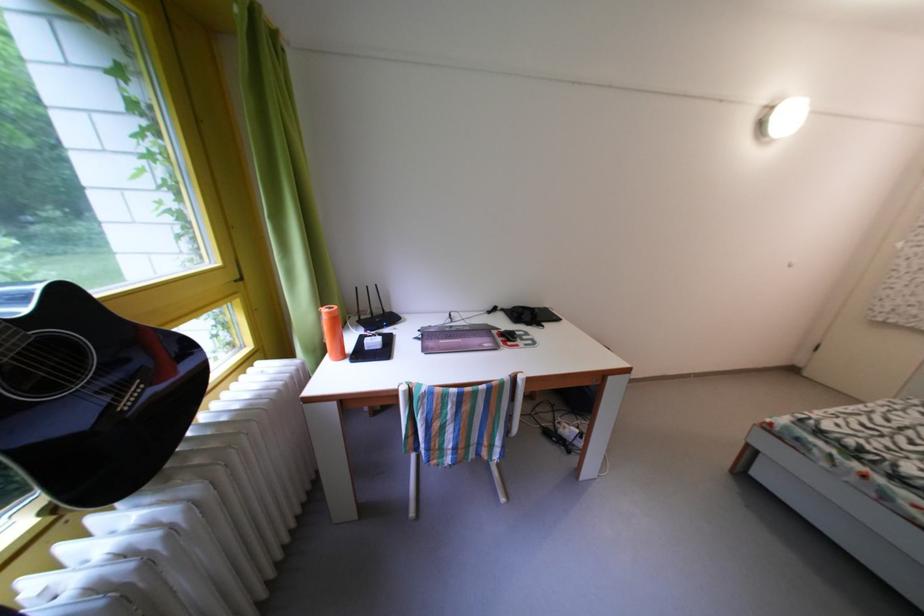
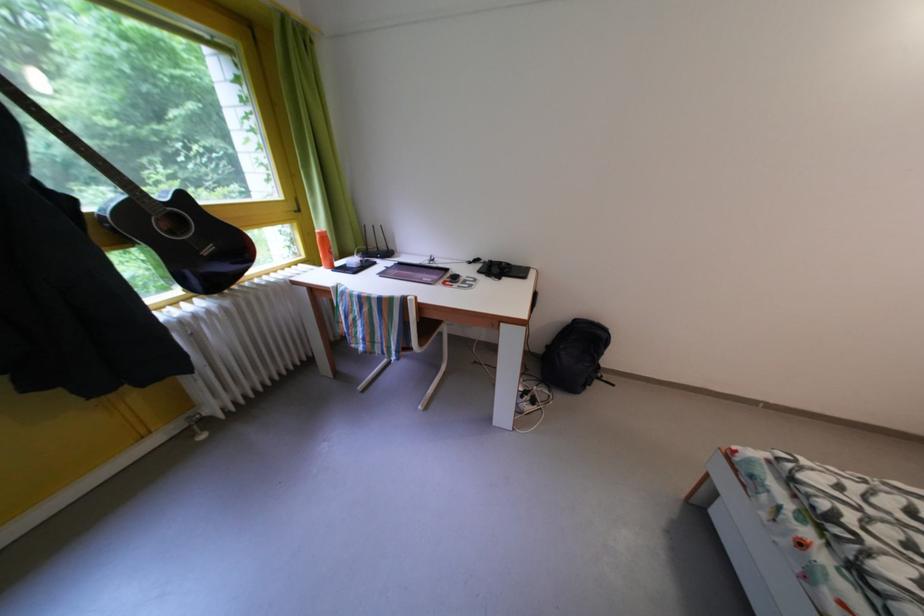
In the second image, find the point that corresponds to the point at 338,318 in the first image.

(329, 238)